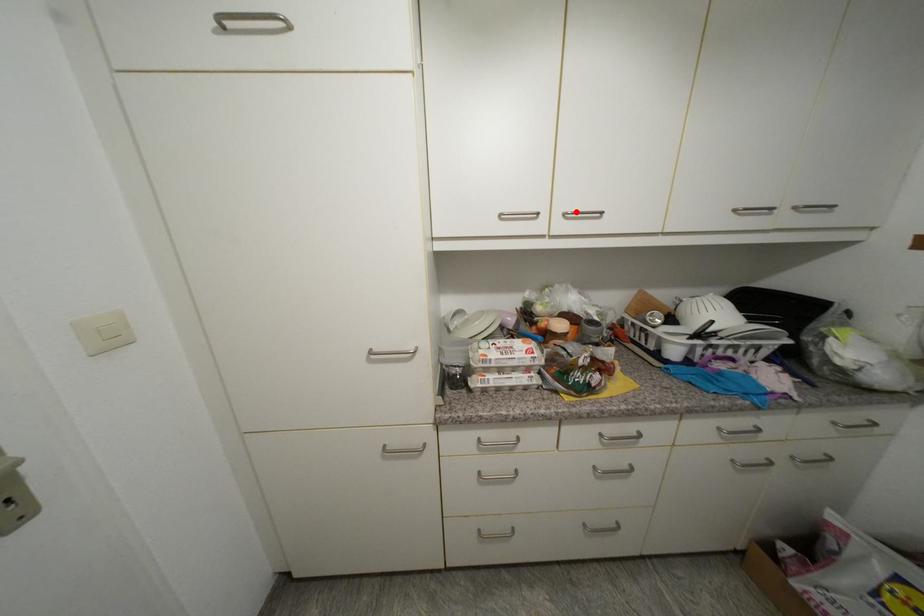
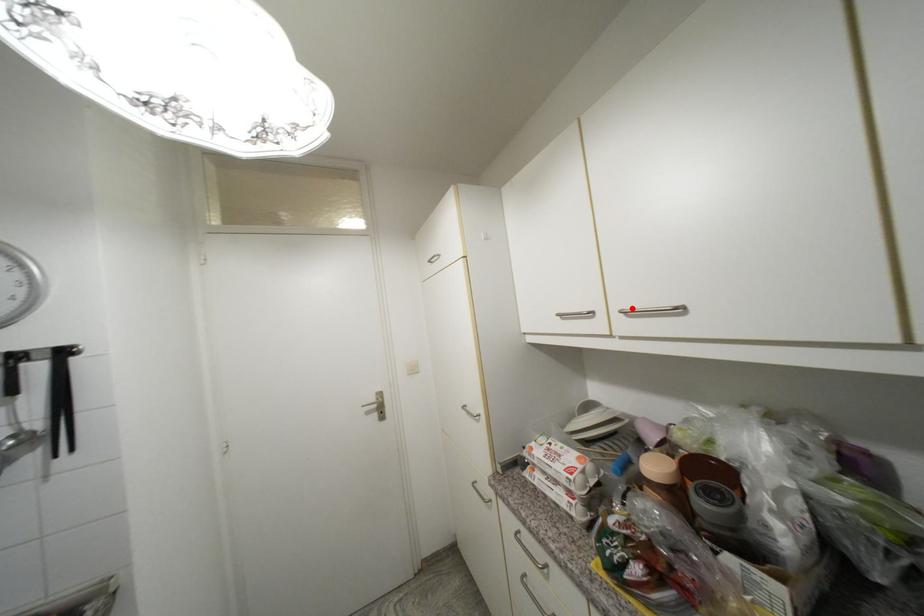
I am providing you with two images of the same scene from different viewpoints. A red point is marked on the first image and another point is marked on the second image. Does the point marked in image1 correspond to the same location as the one in image2?

Yes